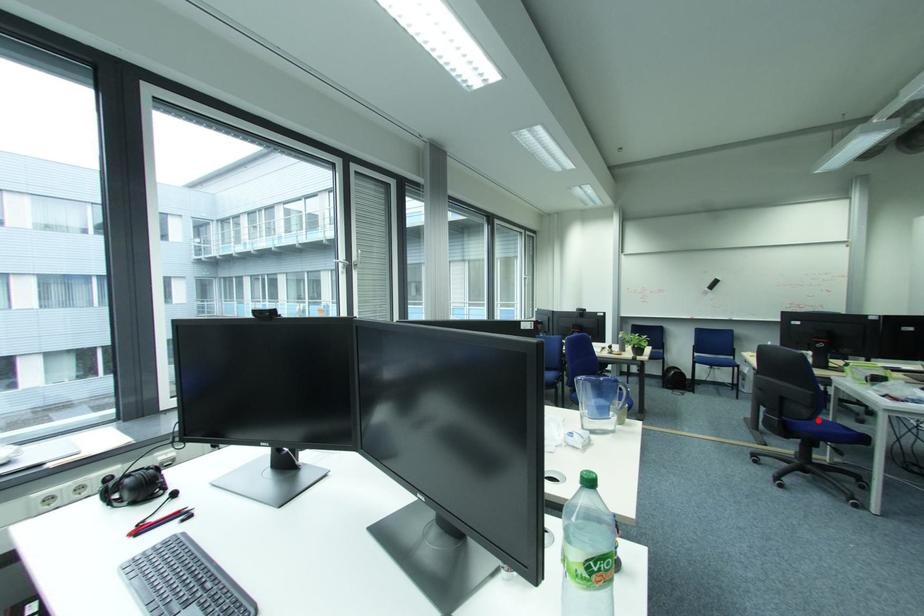
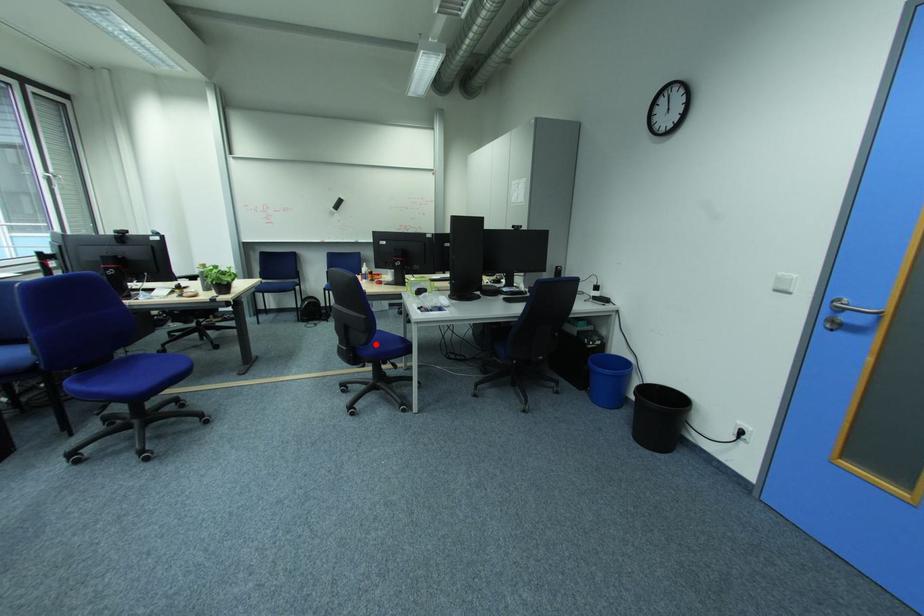
I am providing you with two images of the same scene from different viewpoints. A red point is marked on the first image and another point is marked on the second image. Does the point marked in image1 correspond to the same location as the one in image2?

Yes